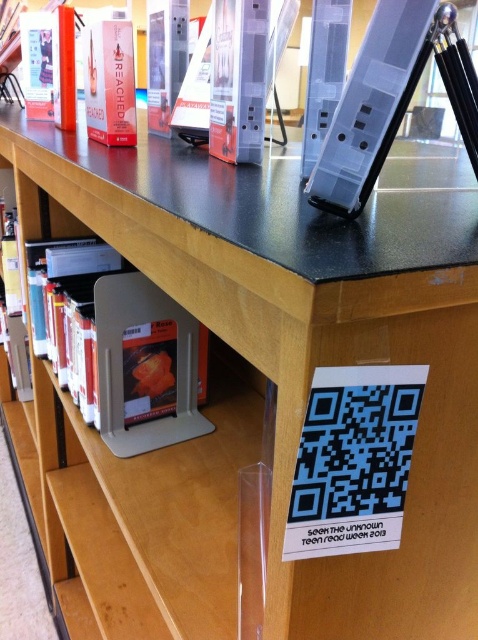
Question: Is blue matte qr code at lower right smaller than matte plastic tablet at upper right?

Choices:
 (A) yes
 (B) no

Answer: (A)

Question: Which point is farther to the camera?

Choices:
 (A) matte red book at upper left
 (B) matte plastic tablet at upper right

Answer: (A)

Question: Is the position of blue matte qr code at lower right less distant than that of matte plastic tablet at upper right?

Choices:
 (A) yes
 (B) no

Answer: (A)

Question: In this image, where is matte plastic tablet at upper right located relative to matte red book at upper left?

Choices:
 (A) left
 (B) right

Answer: (B)

Question: Which point is closer to the camera?

Choices:
 (A) orange matte book at center
 (B) blue matte qr code at lower right

Answer: (B)

Question: Among these objects, which one is nearest to the camera?

Choices:
 (A) matte red book at upper left
 (B) matte plastic tablet at upper right
 (C) orange matte book at center
 (D) blue matte qr code at lower right

Answer: (D)